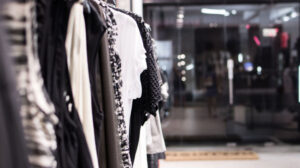
This screenshot has width=300, height=168. Find the location of `door handle`. door handle is located at coordinates point(231,73).